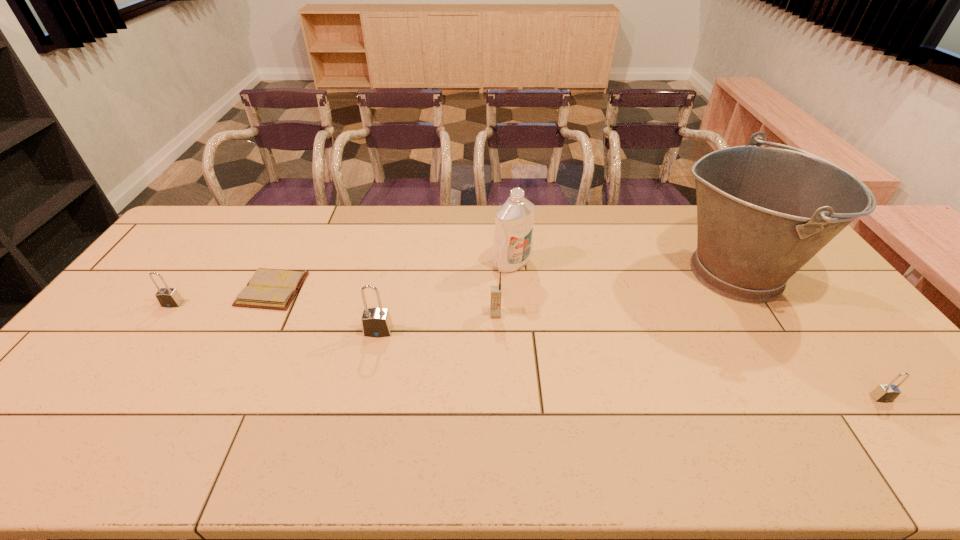
I want to click on spot to insert another padlock for uniform distribution, so click(x=612, y=362).